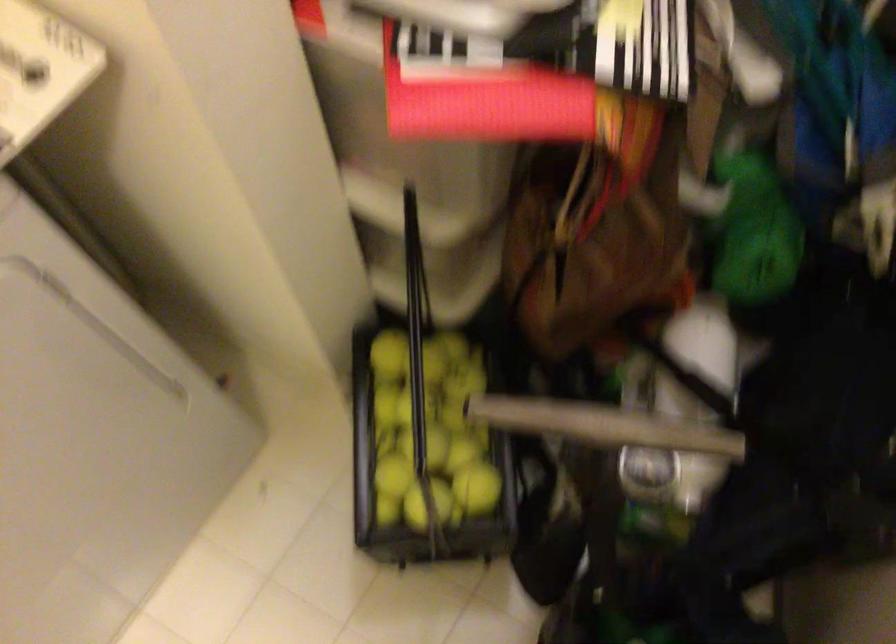
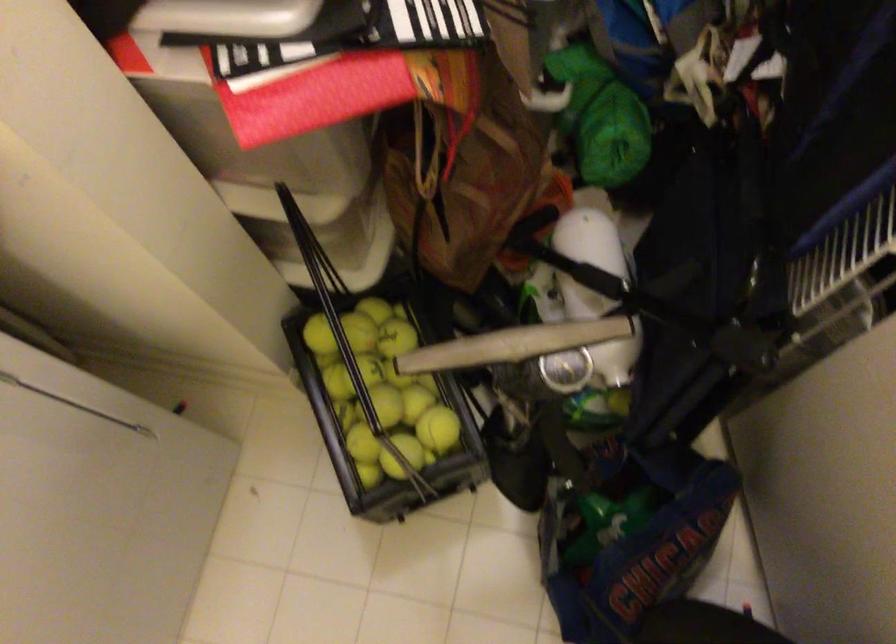
Where in the second image is the point corresponding to point 605,436 from the first image?

(513, 345)